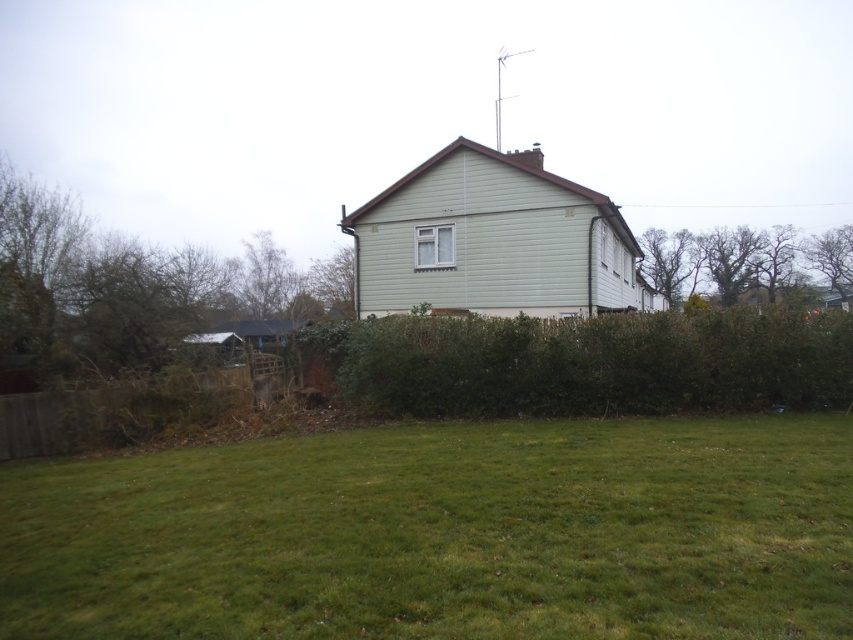
Where is `green grass at lower center`? This screenshot has height=640, width=853. green grass at lower center is located at coordinates click(444, 534).

Between point (843, 552) and point (403, 397), which one is positioned in front?

Point (843, 552)

You are a GUI agent. You are given a task and a screenshot of the screen. Output one action in this format:
    pyautogui.click(x=<x>, y=<y>)
    Task: Click on the green grass at lower center
    The image size is (853, 640).
    Given the screenshot: What is the action you would take?
    pyautogui.click(x=444, y=534)